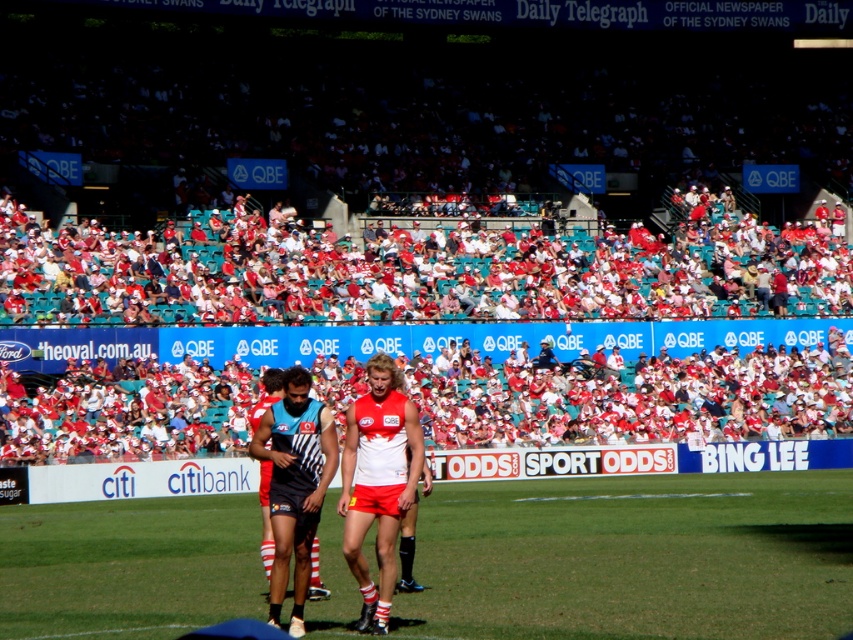
You are a photographer at the Sydney Cricket Ground and want to capture a photo of both the red jersey at center and the matte black uniform at center. From the perspective of the photographer standing at the edge of the field, which player should you focus on first to ensure both are in the frame?

The red jersey at center is positioned on the right side of matte black uniform at center, so you should focus on the matte black uniform at center first as it is closer to the left side, allowing the photographer to frame both players from left to right.

Consider the image. You are a photographer positioned at the edge of the field. You want to take a photo that includes both the red jersey at center and the matte black uniform at center. Based on their positions, which player will appear closer to the camera in your photo?

The red jersey at center is in front of the matte black uniform at center, so the player wearing the red jersey at center will appear closer to the camera in the photo.

You are a photographer at the Sydney Cricket Ground and want to capture a photo that includes both the red fabric seats at upper center and the green grass at center. Which object should you focus on first if you want to include both in your frame without moving the camera?

The red fabric seats at upper center is bigger than the green grass at center, so you should focus on the red fabric seats at upper center first to ensure it fits properly in the frame.